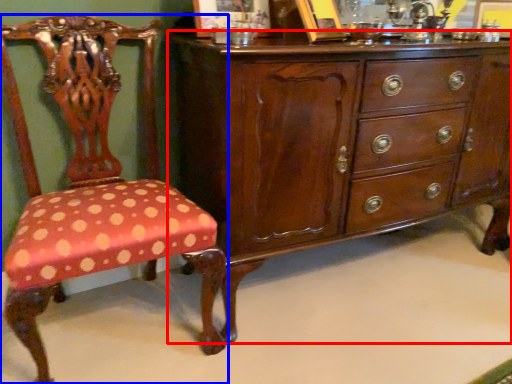
Question: Which object appears closest to the camera in this image, chest of drawers (highlighted by a red box) or chair (highlighted by a blue box)?

Choices:
 (A) chest of drawers
 (B) chair

Answer: (B)